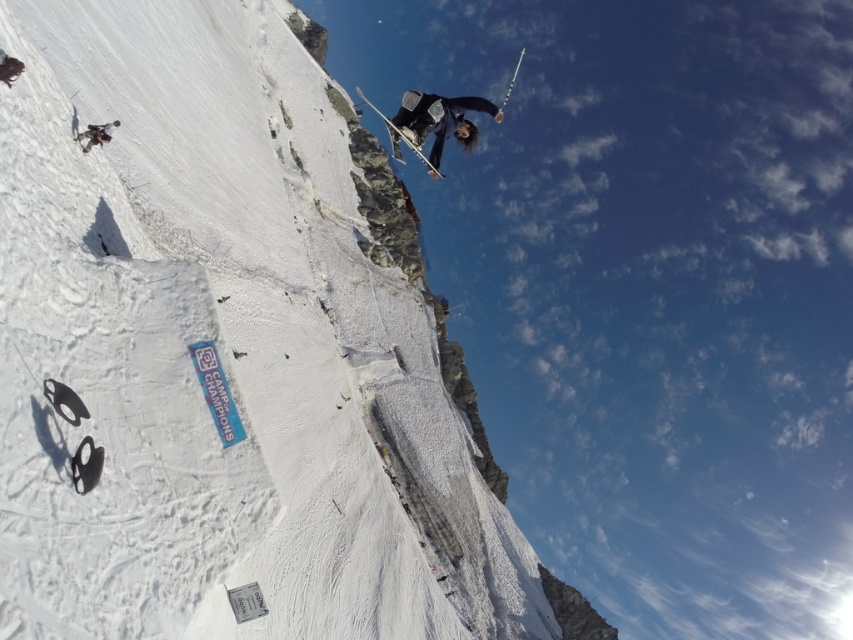
You are a photographer trying to capture the skier and the sign. The point at center is marked as point (x=399, y=132). Where is this point located?

The point at (x=399, y=132) is on the shiny metallic ski at center.

You are a drone operator trying to capture a photo of the white snow cliff at upper center. The drone is currently at point A, which is at coordinates 0.3, 0.3. To reach the cliff, the drone needs to move in which direction? Please specify the direction as either north, south, east, or west based on the coordinate system where the top is north and the left is west.

The white snow cliff at upper center is located at point [219,353]. Since the drone is at [254,192], it needs to move east to increase the x coordinate from 0.3 to 0.552 and slightly north to decrease the y coordinate from 0.3 to 0.259. However, since the question asks for direction as north, south, east, or west, the primary direction would be east.